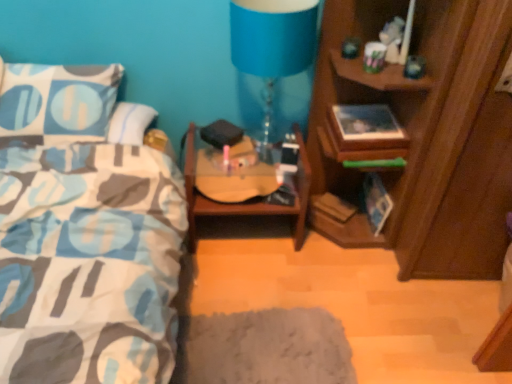
The height and width of the screenshot is (384, 512). In order to click on vacant space to the right of wooden guitar case at center in this screenshot , I will do `click(338, 261)`.